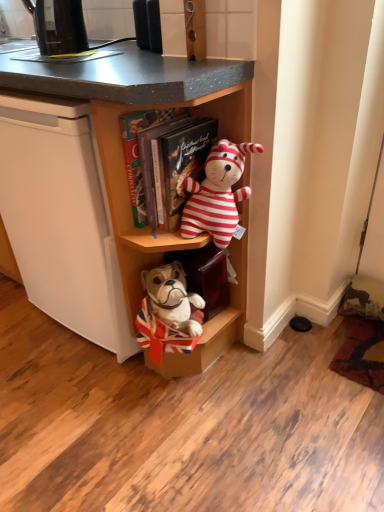
At what (x,y) coordinates should I click in order to perform the action: click on vacant area that is in front of black plastic kettle at upper left. Please return your answer as a coordinate pair (x, y). The width and height of the screenshot is (384, 512). Looking at the image, I should click on (60, 58).